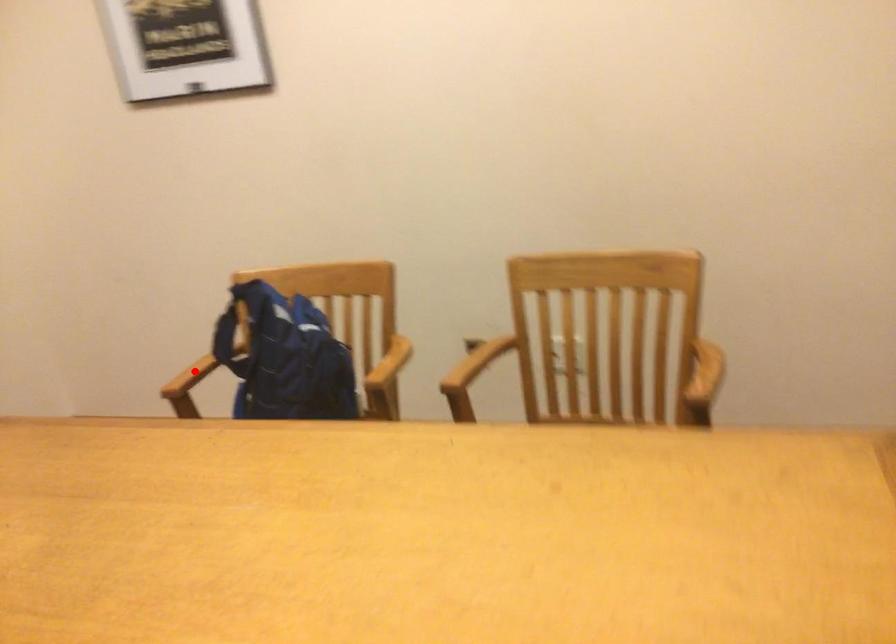
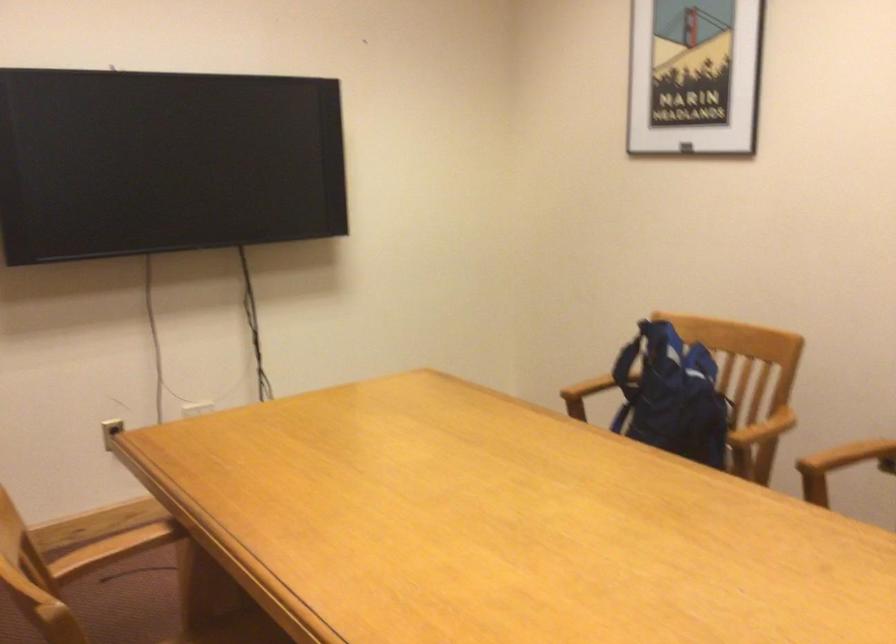
Locate, in the second image, the point that corresponds to the highlighted location in the first image.

(586, 388)